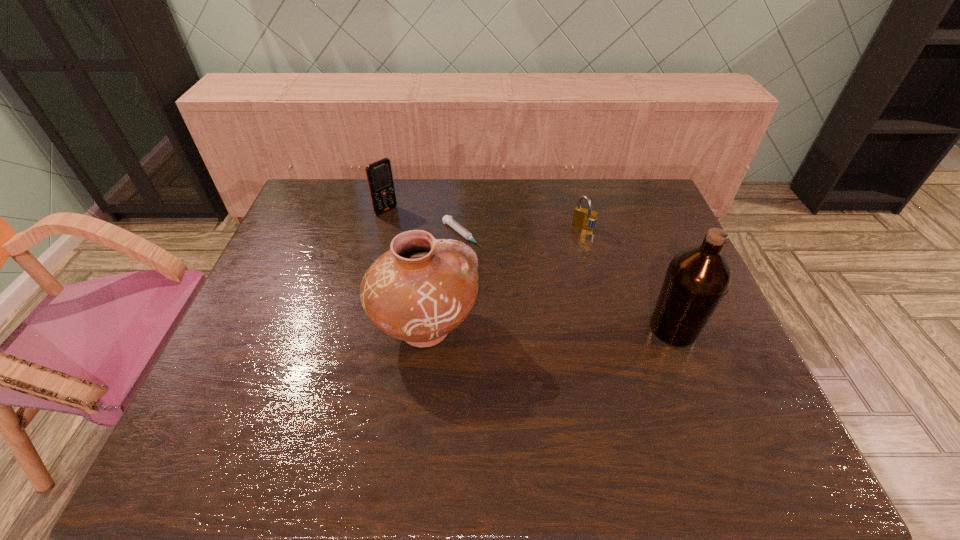
This screenshot has width=960, height=540. I want to click on vacant point located between the rightmost object and the second object from right to left, so click(x=629, y=279).

Where is `the closest object to the second object from right to left`? This screenshot has height=540, width=960. the closest object to the second object from right to left is located at coordinates click(467, 235).

The width and height of the screenshot is (960, 540). Identify the location of the fourth closest object to the pottery. (697, 278).

This screenshot has width=960, height=540. In order to click on vacant region that satisfies the following two spatial constraints: 1. on the front side of the third shortest object; 2. on the label of the olive oil in this screenshot , I will do `click(356, 328)`.

This screenshot has width=960, height=540. Identify the location of blank space that satisfies the following two spatial constraints: 1. on the front side of the cellular telephone; 2. on the left side of the second shortest object. (381, 228).